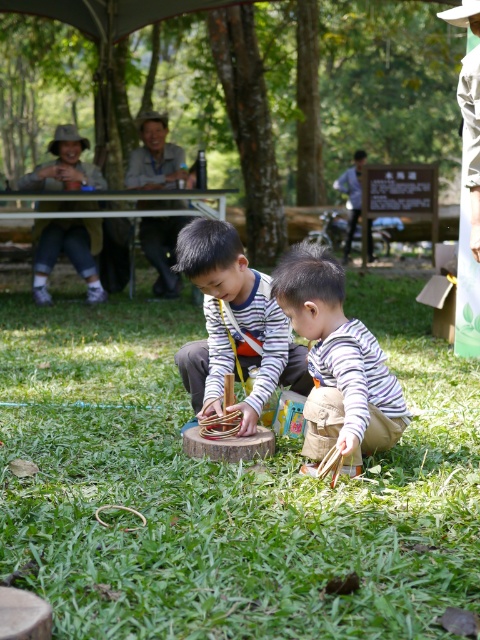
Based on the photo, you are a photographer trying to capture both the striped fabric child at center and the striped fabric boy at center in a single shot. Given that your camera has a maximum focus range of 15 inches, will you be able to focus on both subjects simultaneously?

The striped fabric child at center and the striped fabric boy at center are 15.15 inches apart, which exceeds the camera maximum focus range of 15 inches. Therefore, you cannot focus on both subjects simultaneously.